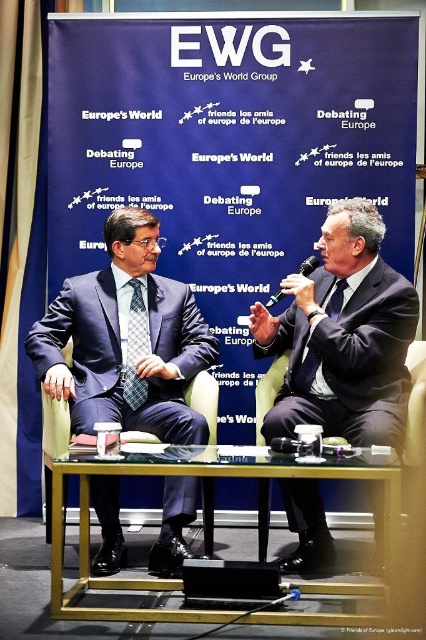
Question: Among these points, which one is farthest from the camera?

Choices:
 (A) (400, 493)
 (B) (143, 332)
 (C) (180, 394)
 (D) (333, 552)

Answer: (B)

Question: Can you confirm if matte blue suit at center is bigger than black plastic microphone at right?

Choices:
 (A) yes
 (B) no

Answer: (A)

Question: Is matte blue suit at center positioned behind matte blue tie at right?

Choices:
 (A) no
 (B) yes

Answer: (A)

Question: Which of the following is the closest to the observer?

Choices:
 (A) plaid silk tie at center
 (B) matte black suit at center
 (C) matte blue suit at center
 (D) black plastic microphone at right

Answer: (B)

Question: Does matte black suit at center have a smaller size compared to clear glass table at center?

Choices:
 (A) yes
 (B) no

Answer: (A)

Question: Which point appears farthest from the camera in this image?

Choices:
 (A) (83, 296)
 (B) (161, 472)
 (C) (307, 349)
 (D) (132, 339)

Answer: (A)